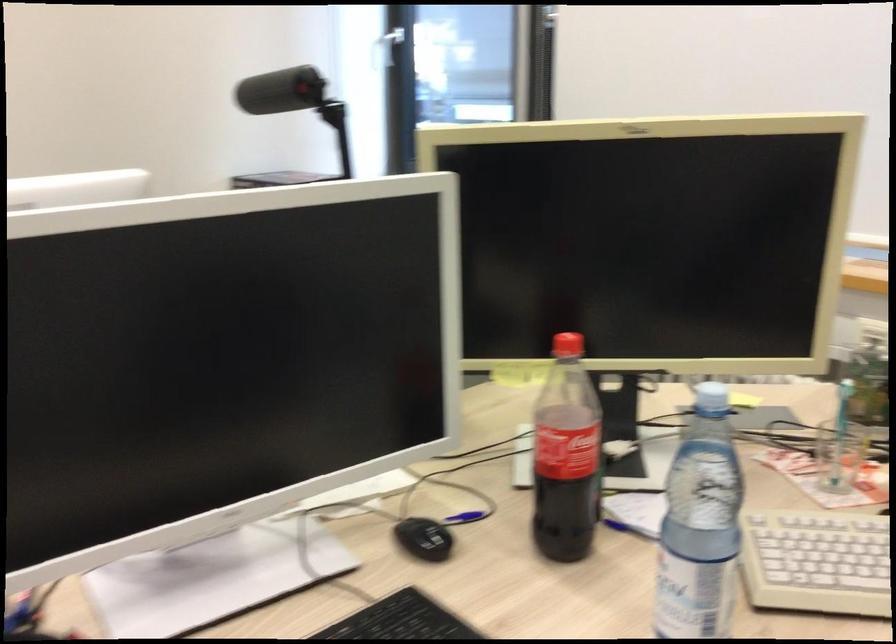
Identify the location of black microphone. The height and width of the screenshot is (644, 896). (280, 91).